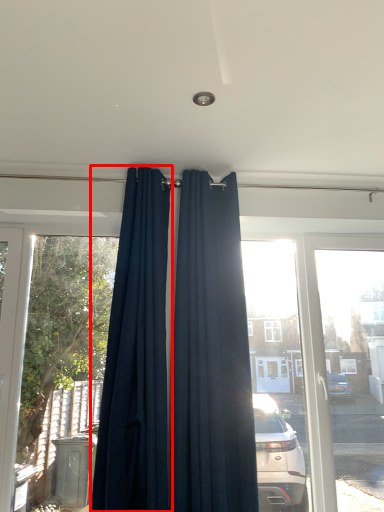
Question: Where is curtain (annotated by the red box) located in relation to curtain in the image?

Choices:
 (A) left
 (B) right

Answer: (A)